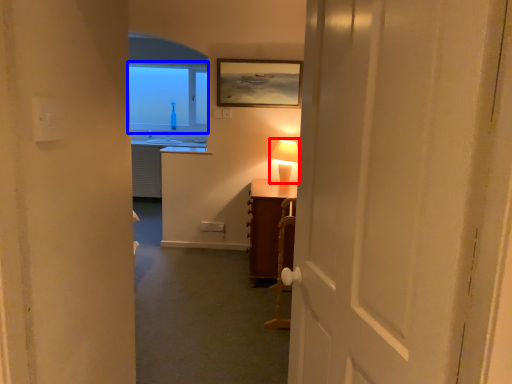
Question: Among these objects, which one is farthest to the camera, table lamp (highlighted by a red box) or window (highlighted by a blue box)?

Choices:
 (A) table lamp
 (B) window

Answer: (B)